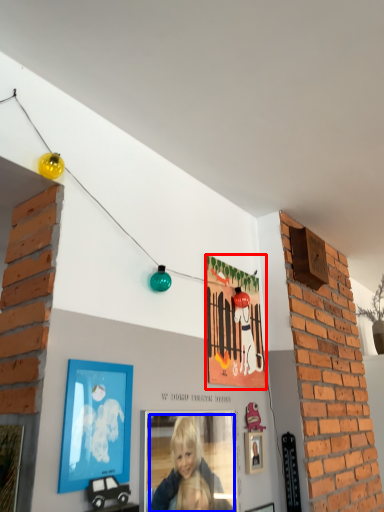
Question: Which point is further to the camera, picture frame (highlighted by a red box) or person (highlighted by a blue box)?

Choices:
 (A) picture frame
 (B) person

Answer: (A)